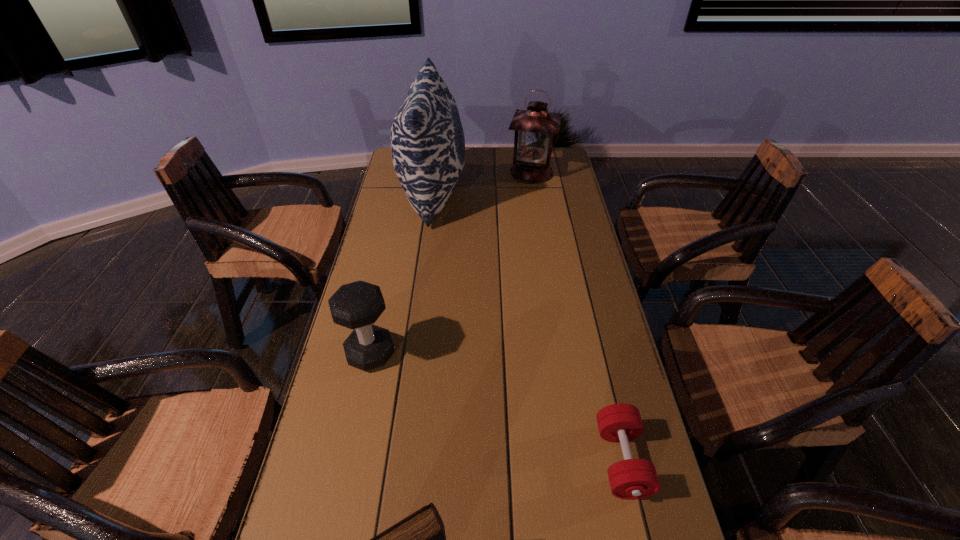
Find the location of a particular element. cushion situated at the far edge is located at coordinates (427, 140).

The image size is (960, 540). Find the location of `oil lamp present at the far edge`. oil lamp present at the far edge is located at coordinates (535, 127).

The width and height of the screenshot is (960, 540). Identify the location of cushion at the left edge. (427, 140).

Identify the location of dumbbell located at the left edge. (357, 305).

Image resolution: width=960 pixels, height=540 pixels. What are the coordinates of `oil lamp located in the right edge section of the desktop` in the screenshot? It's located at (535, 127).

Image resolution: width=960 pixels, height=540 pixels. I want to click on dumbbell at the right edge, so click(x=630, y=478).

At what (x,y) coordinates should I click in order to perform the action: click on object located in the far left corner section of the desktop. Please return your answer as a coordinate pair (x, y). The height and width of the screenshot is (540, 960). Looking at the image, I should click on [x=427, y=140].

Locate an element on the screen. The image size is (960, 540). object situated at the far right corner is located at coordinates (535, 127).

Where is `vacant space at the far edge of the desktop`? The width and height of the screenshot is (960, 540). vacant space at the far edge of the desktop is located at coordinates (506, 148).

Identify the location of vacant area at the left edge of the desktop. (400, 338).